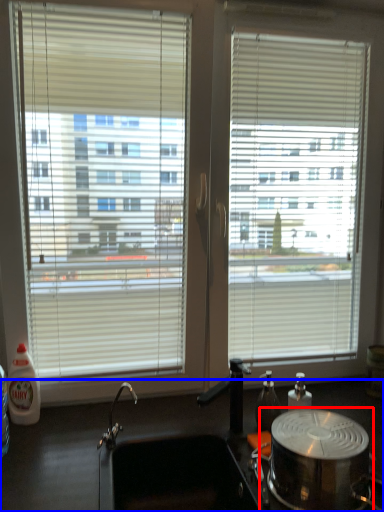
Question: Which point is closer to the camera, appliance (highlighted by a red box) or counter top (highlighted by a blue box)?

Choices:
 (A) appliance
 (B) counter top

Answer: (B)